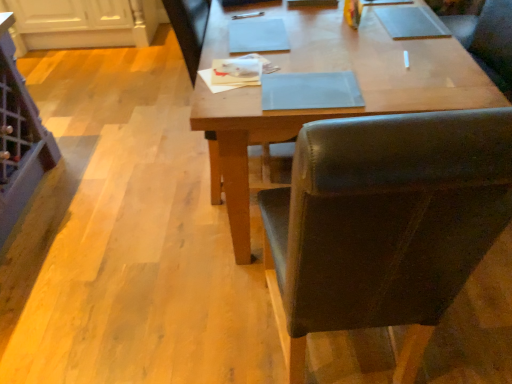
Find the location of a particular element. The image size is (512, 384). free space to the left of wooden desk at center is located at coordinates (117, 171).